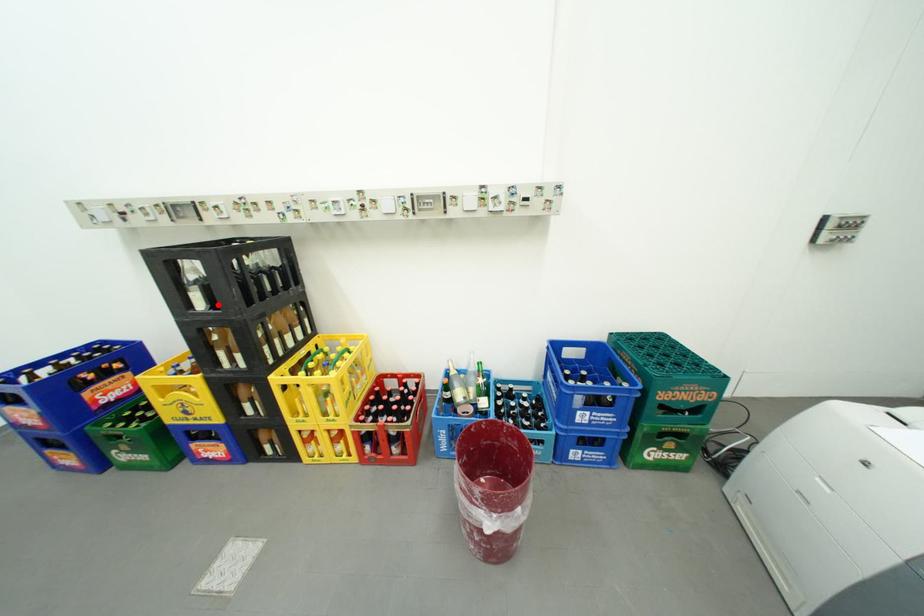
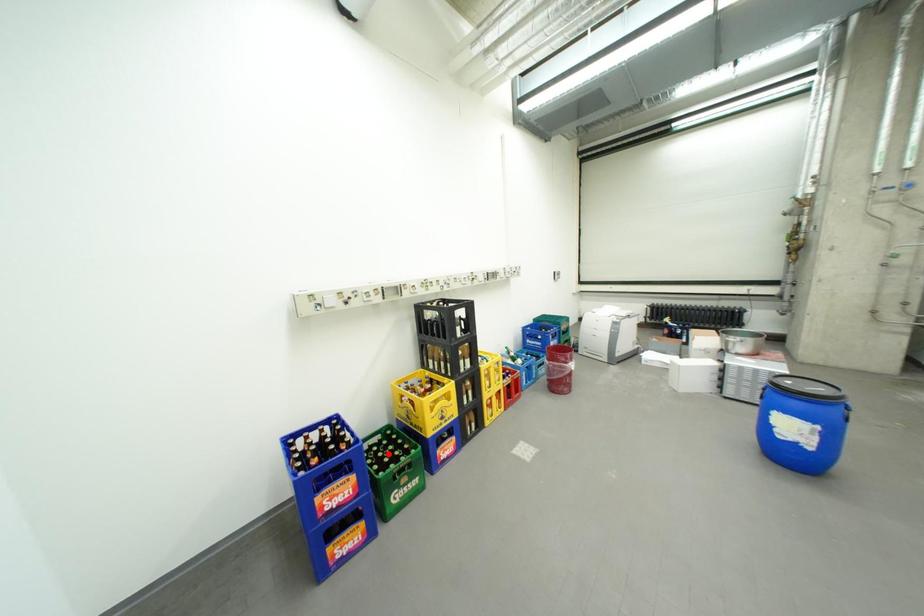
I am providing you with two images of the same scene from different viewpoints. A red point is marked on the first image and another point is marked on the second image. Are the points marked in image1 and image2 representing the same 3D position?

No